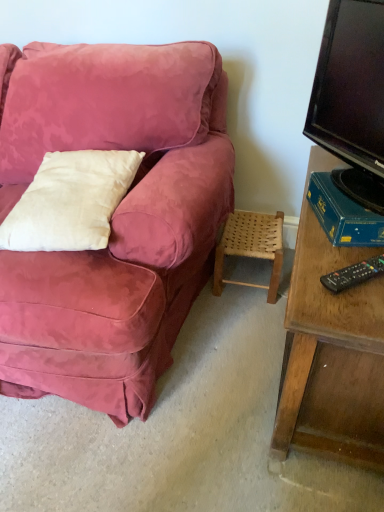
In order to click on blue cardboard book at right in this screenshot , I will do `click(343, 215)`.

At what (x,y) coordinates should I click in order to perform the action: click on woven wood stool at lower right. Please return your answer as a coordinate pair (x, y). Looking at the image, I should click on (251, 246).

Locate an element on the screen. The height and width of the screenshot is (512, 384). blue cardboard book at right is located at coordinates (343, 215).

Between black plastic remote control at lower right and blue cardboard book at right, which one has smaller size?

black plastic remote control at lower right.

Is black plastic remote control at lower right oriented away from blue cardboard book at right?

Correct, black plastic remote control at lower right is looking away from blue cardboard book at right.

Is black plastic remote control at lower right wider than blue cardboard book at right?

Incorrect, the width of black plastic remote control at lower right does not surpass that of blue cardboard book at right.

In the scene shown: Which of these two, black plastic remote control at lower right or blue cardboard book at right, stands shorter?

Standing shorter between the two is black plastic remote control at lower right.

Between blue cardboard book at right and black plastic remote control at lower right, which one appears on the left side from the viewer's perspective?

Positioned to the left is black plastic remote control at lower right.

Is blue cardboard book at right placed right next to black plastic remote control at lower right?

blue cardboard book at right is not next to black plastic remote control at lower right, and they're not touching.

This screenshot has height=512, width=384. In order to click on book lying on the right of black plastic remote control at lower right in this screenshot , I will do `click(343, 215)`.

From the picture: From the image's perspective, is blue cardboard book at right positioned above or below black plastic remote control at lower right?

From the image's perspective, blue cardboard book at right appears above black plastic remote control at lower right.

Is woven wood stool at lower right thinner than black glossy tv at right?

No.

From their relative heights in the image, would you say woven wood stool at lower right is taller or shorter than black glossy tv at right?

In the image, woven wood stool at lower right appears to be shorter than black glossy tv at right.

Would you say woven wood stool at lower right is inside or outside black glossy tv at right?

woven wood stool at lower right is outside black glossy tv at right.

Is woven wood stool at lower right to the left of black glossy tv at right from the viewer's perspective?

Yes, woven wood stool at lower right is to the left of black glossy tv at right.

Choose the correct answer: Is white cotton pillow at left inside black glossy tv at right or outside it?

white cotton pillow at left cannot be found inside black glossy tv at right.

Based on their sizes in the image, would you say white cotton pillow at left is bigger or smaller than black glossy tv at right?

Clearly, white cotton pillow at left is smaller in size than black glossy tv at right.

From the picture: Which is less distant, (333, 180) or (65, 245)?

Point (333, 180) is positioned farther from the camera compared to point (65, 245).

Is blue cardboard book at right far from white cotton pillow at left?

No, there isn't a large distance between blue cardboard book at right and white cotton pillow at left.

Based on the photo, from a real-world perspective, between blue cardboard book at right and white cotton pillow at left, who is vertically higher?

In real-world perspective, blue cardboard book at right is above.

Is point (360, 11) positioned behind point (263, 233)?

No, (360, 11) is in front of (263, 233).

Based on the photo, from the image's perspective, is black glossy tv at right positioned above or below woven wood stool at lower right?

Clearly, from the image's perspective, black glossy tv at right is above woven wood stool at lower right.

Would you consider black glossy tv at right to be distant from woven wood stool at lower right?

black glossy tv at right is actually quite close to woven wood stool at lower right.

From a real-world perspective, is white cotton pillow at left physically below black plastic remote control at lower right?

No.

Where is `pillow on the left side of black plastic remote control at lower right`? pillow on the left side of black plastic remote control at lower right is located at coordinates (70, 201).

In terms of height, does white cotton pillow at left look taller or shorter compared to black plastic remote control at lower right?

Clearly, white cotton pillow at left is taller compared to black plastic remote control at lower right.

Considering the sizes of white cotton pillow at left and black plastic remote control at lower right in the image, is white cotton pillow at left bigger or smaller than black plastic remote control at lower right?

white cotton pillow at left is bigger than black plastic remote control at lower right.

Where is `book above the black plastic remote control at lower right (from a real-world perspective)`? Image resolution: width=384 pixels, height=512 pixels. book above the black plastic remote control at lower right (from a real-world perspective) is located at coordinates (343, 215).

Locate an element on the screen. This screenshot has width=384, height=512. book lying on the right of black plastic remote control at lower right is located at coordinates (343, 215).

Considering their positions, is blue cardboard book at right positioned further to white cotton pillow at left than black plastic remote control at lower right?

Based on the image, black plastic remote control at lower right appears to be further to white cotton pillow at left.

Which object lies further to the anchor point black glossy tv at right, white cotton pillow at left or black plastic remote control at lower right?

Among the two, white cotton pillow at left is located further to black glossy tv at right.

Estimate the real-world distances between objects in this image. Which object is closer to white cotton pillow at left, blue cardboard book at right or black glossy tv at right?

Among the two, blue cardboard book at right is located nearer to white cotton pillow at left.

Estimate the real-world distances between objects in this image. Which object is further from black plastic remote control at lower right, blue cardboard book at right or black glossy tv at right?

black glossy tv at right lies further to black plastic remote control at lower right than the other object.

Which object lies nearer to the anchor point blue cardboard book at right, white cotton pillow at left or woven wood stool at lower right?

Among the two, woven wood stool at lower right is located nearer to blue cardboard book at right.

Considering their positions, is white cotton pillow at left positioned further to woven wood stool at lower right than black glossy tv at right?

white cotton pillow at left is positioned further to the anchor woven wood stool at lower right.

Estimate the real-world distances between objects in this image. Which object is further from woven wood stool at lower right, white cotton pillow at left or blue cardboard book at right?

white cotton pillow at left.

From the image, which object appears to be nearer to white cotton pillow at left, black glossy tv at right or black plastic remote control at lower right?

black glossy tv at right is positioned closer to the anchor white cotton pillow at left.

The image size is (384, 512). Find the location of `book between black glossy tv at right and woven wood stool at lower right along the z-axis`. book between black glossy tv at right and woven wood stool at lower right along the z-axis is located at coordinates (343, 215).

Locate an element on the screen. stool located between white cotton pillow at left and blue cardboard book at right in the left-right direction is located at coordinates (251, 246).

Identify the location of remote control located between white cotton pillow at left and black glossy tv at right in the left-right direction. (x=353, y=274).

Locate an element on the screen. The image size is (384, 512). book located between black plastic remote control at lower right and woven wood stool at lower right in the depth direction is located at coordinates (343, 215).